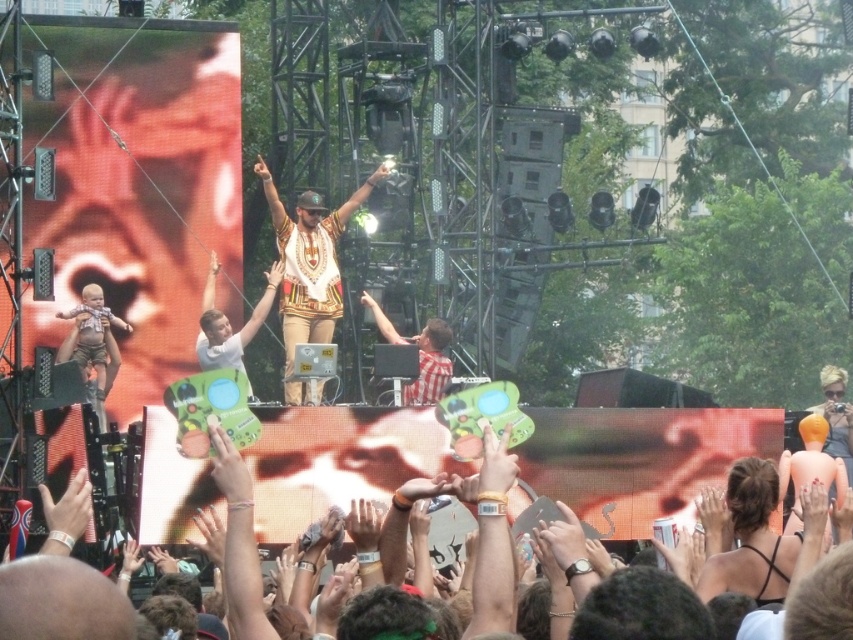
What is the color of the sign located at point (59,602)?

The sign located at point (59,602) is matte green.

You are standing at the front of the concert stage and want to move towards the point that is closer to you. Which point should you move towards, point [219,460] or point [274,216]?

You should move towards point [219,460] because it is closer to the viewer than point [274,216].

You are an event planner checking the stage setup. You need to ensure that the matte green sign at center and the white printed shirt at center are both visible to the audience. Based on their sizes, which one is more likely to be easily seen from the back of the venue?

The matte green sign at center has a larger size compared to the white printed shirt at center, so it is more likely to be easily seen from the back of the venue.